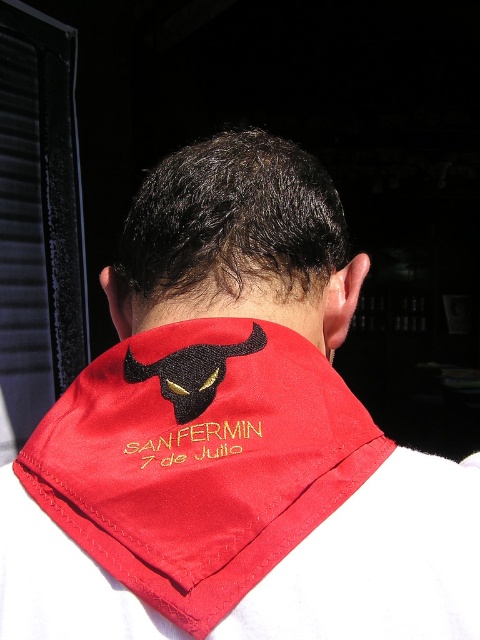
Question: Which point is farther from the camera taking this photo?

Choices:
 (A) (180, 435)
 (B) (204, 280)

Answer: (B)

Question: From the image, what is the correct spatial relationship of red satin neckband at back in relation to red satin bandana at center?

Choices:
 (A) below
 (B) above

Answer: (A)

Question: Is red satin neckband at back to the right of red satin bandana at center from the viewer's perspective?

Choices:
 (A) yes
 (B) no

Answer: (B)

Question: Which of the following is the closest to the observer?

Choices:
 (A) red satin neckband at back
 (B) red satin bandana at center

Answer: (A)

Question: Which of these objects is positioned closest to the red satin neckband at back?

Choices:
 (A) red satin bandana at center
 (B) yellow embroidered text at center

Answer: (B)

Question: Does red satin neckband at back appear under red satin bandana at center?

Choices:
 (A) yes
 (B) no

Answer: (A)